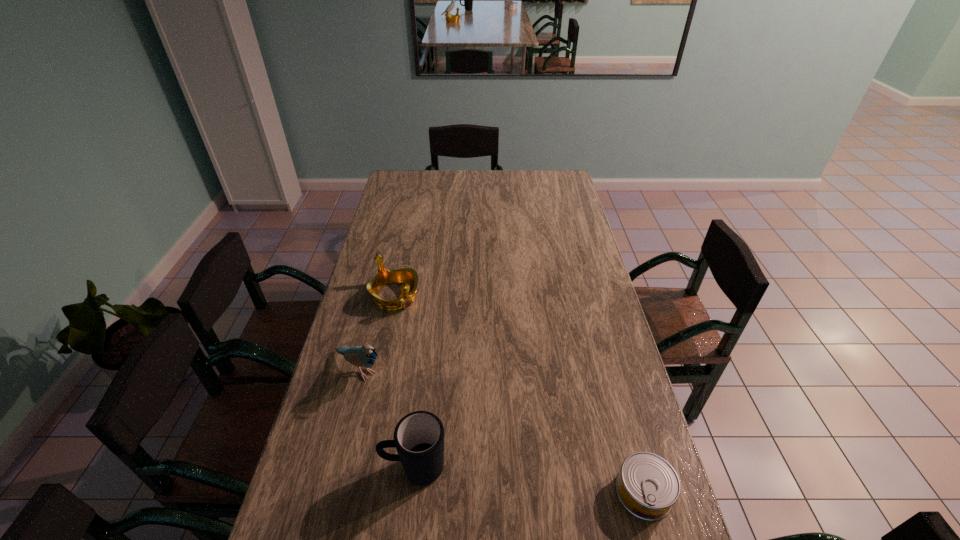
What are the coordinates of `vacant area that lies between the farthest object and the third nearest object` in the screenshot? It's located at [377, 332].

Where is `free space between the tiara and the shortest object`? This screenshot has width=960, height=540. free space between the tiara and the shortest object is located at coordinates (519, 394).

Identify the location of free space between the second shortest object and the mug. The width and height of the screenshot is (960, 540). (404, 382).

The width and height of the screenshot is (960, 540). In order to click on free space between the third tallest object and the third nearest object in this screenshot , I will do `click(377, 332)`.

This screenshot has height=540, width=960. What are the coordinates of `vacant area that lies between the mug and the shortest object` in the screenshot? It's located at (529, 480).

Identify which object is the third nearest to the rightmost object. Please provide its 2D coordinates. Your answer should be formatted as a tuple, i.e. [(x, y)], where the tuple contains the x and y coordinates of a point satisfying the conditions above.

[(408, 276)]

You are a GUI agent. You are given a task and a screenshot of the screen. Output one action in this format:
    pyautogui.click(x=<x>, y=<y>)
    Task: Click on the second closest object to the second farthest object
    This screenshot has height=540, width=960.
    Given the screenshot: What is the action you would take?
    pyautogui.click(x=419, y=436)

Locate an element on the screen. This screenshot has height=540, width=960. free space in the image that satisfies the following two spatial constraints: 1. on the front side of the mug; 2. on the side of the farthest object with the handle is located at coordinates (358, 468).

What are the coordinates of `vacant area that satisfies the following two spatial constraints: 1. on the back side of the bird; 2. on the left side of the tiara` in the screenshot? It's located at (378, 295).